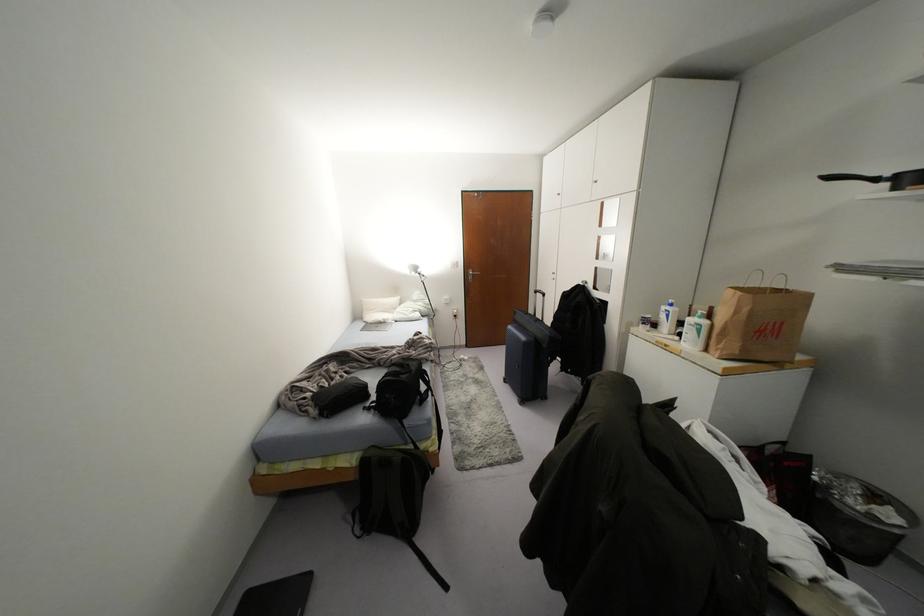
This screenshot has width=924, height=616. In order to click on silver door handle in this screenshot , I will do `click(471, 275)`.